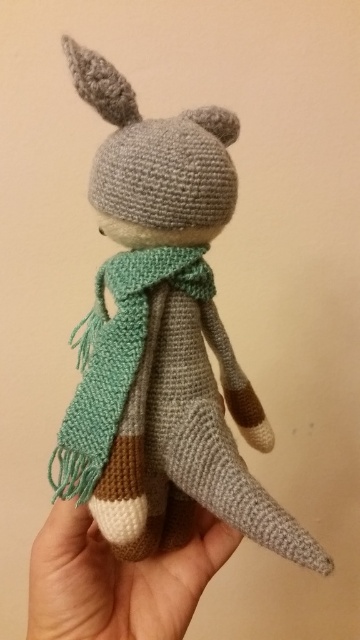
Question: Which point is farther to the camera?

Choices:
 (A) white soft hand at lower center
 (B) green knitted scarf at center
 (C) gray yarn toy at center

Answer: (A)

Question: Which of the following is the farthest from the observer?

Choices:
 (A) green knitted scarf at center
 (B) white soft hand at lower center

Answer: (B)

Question: Does gray yarn toy at center have a larger size compared to white soft hand at lower center?

Choices:
 (A) no
 (B) yes

Answer: (B)

Question: Does gray yarn toy at center appear over green knitted scarf at center?

Choices:
 (A) yes
 (B) no

Answer: (A)

Question: Where is gray yarn toy at center located in relation to green knitted scarf at center in the image?

Choices:
 (A) left
 (B) right

Answer: (B)

Question: Which object is the farthest from the green knitted scarf at center?

Choices:
 (A) white soft hand at lower center
 (B) gray yarn toy at center

Answer: (A)